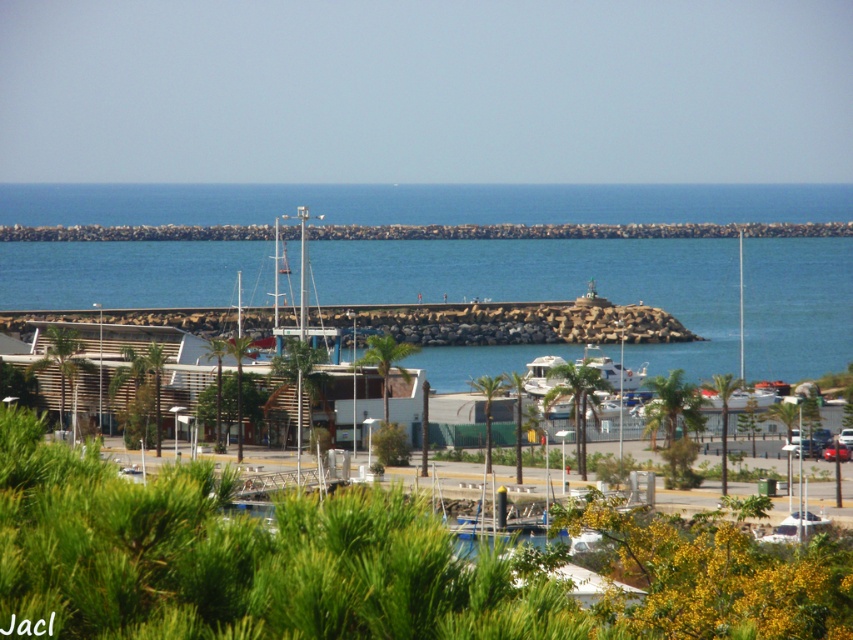
Is rocky jetty at center smaller than shiny red car at center?

Actually, rocky jetty at center might be larger than shiny red car at center.

In the scene shown: Can you confirm if rocky jetty at center is taller than shiny red car at center?

Indeed, rocky jetty at center has a greater height compared to shiny red car at center.

Between point (683, 236) and point (840, 458), which one is positioned in front?

Positioned in front is point (840, 458).

In order to click on rocky jetty at center in this screenshot , I will do `click(579, 230)`.

Is point (846, 289) less distant than point (838, 232)?

That is True.

The height and width of the screenshot is (640, 853). I want to click on blue stone water at center, so click(554, 282).

At what (x,y) coordinates should I click in order to perform the action: click on blue stone water at center. Please return your answer as a coordinate pair (x, y). Looking at the image, I should click on (554, 282).

Between blue stone water at center and shiny red car at center, which one is positioned higher?

blue stone water at center

Can you confirm if blue stone water at center is positioned above shiny red car at center?

Yes.

Is point (62, 273) farther from camera compared to point (836, 456)?

That is True.

Locate an element on the screen. blue stone water at center is located at coordinates (554, 282).